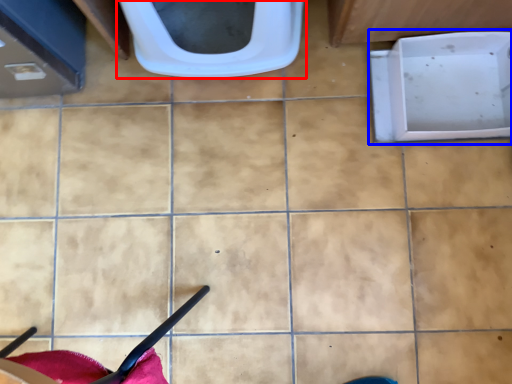
Question: Which object is further to the camera taking this photo, toilet (highlighted by a red box) or bath (highlighted by a blue box)?

Choices:
 (A) toilet
 (B) bath

Answer: (B)